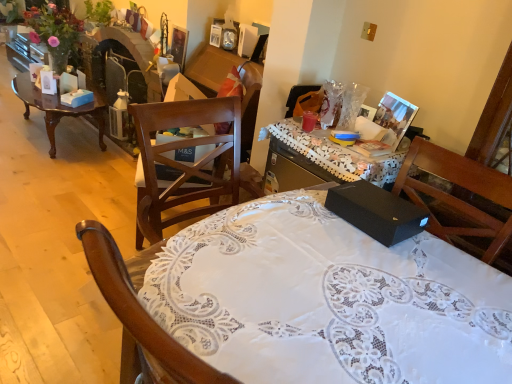
Question: Is wooden polished coffee table at left at the back of brown wooden chair at center?

Choices:
 (A) no
 (B) yes

Answer: (A)

Question: Can you confirm if brown wooden chair at center is smaller than wooden polished coffee table at left?

Choices:
 (A) yes
 (B) no

Answer: (B)

Question: From the image's perspective, is brown wooden chair at center on top of wooden polished coffee table at left?

Choices:
 (A) yes
 (B) no

Answer: (B)

Question: Is wooden polished coffee table at left located within brown wooden chair at center?

Choices:
 (A) no
 (B) yes

Answer: (A)

Question: Considering the relative positions of brown wooden chair at center and wooden polished coffee table at left in the image provided, is brown wooden chair at center to the right of wooden polished coffee table at left from the viewer's perspective?

Choices:
 (A) yes
 (B) no

Answer: (A)

Question: Choose the correct answer: Is black matte box at center inside wooden polished coffee table at left or outside it?

Choices:
 (A) inside
 (B) outside

Answer: (B)

Question: In terms of width, does black matte box at center look wider or thinner when compared to wooden polished coffee table at left?

Choices:
 (A) wide
 (B) thin

Answer: (B)

Question: From the image's perspective, is black matte box at center above or below wooden polished coffee table at left?

Choices:
 (A) above
 (B) below

Answer: (B)

Question: Is point (394, 203) closer or farther from the camera than point (48, 102)?

Choices:
 (A) closer
 (B) farther

Answer: (A)

Question: Relative to matte plastic cup at center, is black matte box at center in front or behind?

Choices:
 (A) behind
 (B) front

Answer: (B)

Question: Is black matte box at center taller or shorter than matte plastic cup at center?

Choices:
 (A) tall
 (B) short

Answer: (A)

Question: From the image's perspective, is black matte box at center above or below matte plastic cup at center?

Choices:
 (A) below
 (B) above

Answer: (A)

Question: Is point (320, 342) closer or farther from the camera than point (310, 125)?

Choices:
 (A) farther
 (B) closer

Answer: (B)

Question: Would you say wooden polished coffee table at left is inside or outside brown wooden chair at center?

Choices:
 (A) inside
 (B) outside

Answer: (B)

Question: Considering the positions of wooden polished coffee table at left and brown wooden chair at center in the image, is wooden polished coffee table at left taller or shorter than brown wooden chair at center?

Choices:
 (A) tall
 (B) short

Answer: (B)